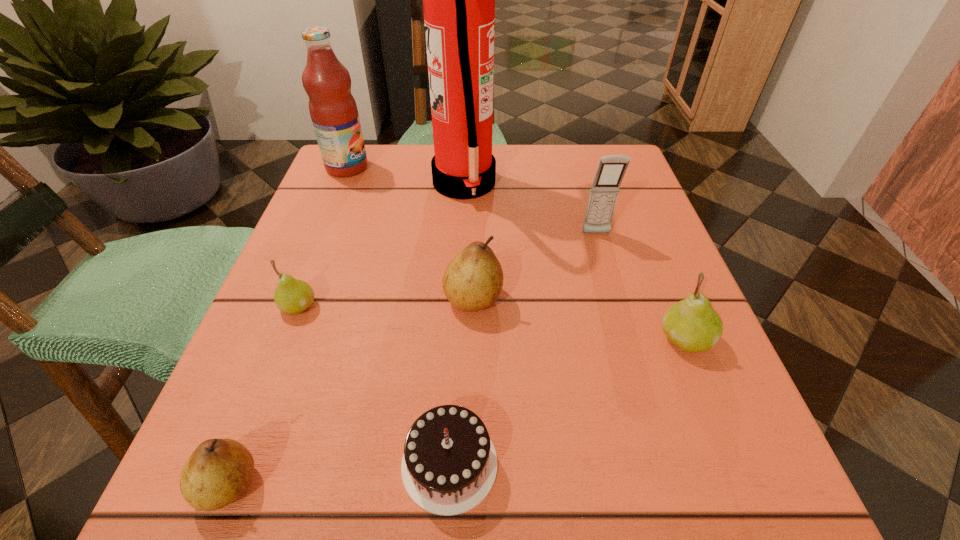
Locate an element on the screen. This screenshot has width=960, height=540. the smaller brown pear is located at coordinates (218, 472).

Locate an element on the screen. The height and width of the screenshot is (540, 960). the nearer brown pear is located at coordinates (218, 472).

Locate an element on the screen. chocolate cake is located at coordinates (449, 465).

Where is `free location located with the nozzle aimed from the tallest object`? Image resolution: width=960 pixels, height=540 pixels. free location located with the nozzle aimed from the tallest object is located at coordinates click(532, 184).

Image resolution: width=960 pixels, height=540 pixels. In order to click on free space located 0.220m on the front label of the fruit juice in this screenshot , I will do `click(462, 167)`.

At what (x,y) coordinates should I click in order to perform the action: click on vacant space situated on the front-facing side of the gray cellular telephone. Please return your answer as a coordinate pair (x, y). Image resolution: width=960 pixels, height=540 pixels. Looking at the image, I should click on (612, 291).

Locate an element on the screen. This screenshot has height=540, width=960. vacant space situated on the left of the third pear from left to right is located at coordinates (283, 298).

Find the location of a particular element. This screenshot has height=540, width=960. free space located on the left of the right green pear is located at coordinates 588,339.

Where is `free space located 0.190m on the right of the left green pear`? free space located 0.190m on the right of the left green pear is located at coordinates (432, 306).

Locate an element on the screen. The image size is (960, 540). vacant space situated 0.310m on the right of the left brown pear is located at coordinates (518, 484).